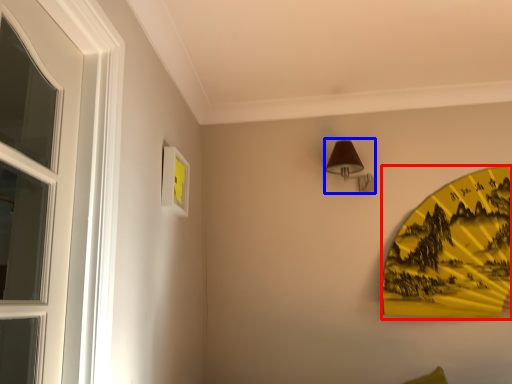
Question: Which of the following is the farthest to the observer, design (highlighted by a red box) or lamp (highlighted by a blue box)?

Choices:
 (A) design
 (B) lamp

Answer: (B)